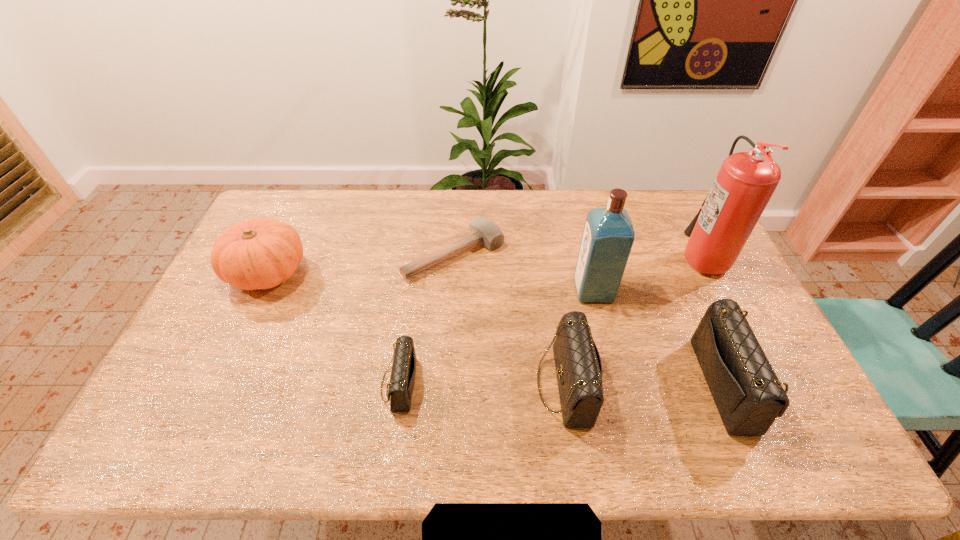
Where is `the sixth tallest object`? The width and height of the screenshot is (960, 540). the sixth tallest object is located at coordinates (402, 378).

Identify the location of the shortest clutch bag. This screenshot has width=960, height=540. (402, 378).

This screenshot has height=540, width=960. I want to click on the fourth object from left to right, so click(x=578, y=365).

Identify the location of the second tallest clutch bag. (578, 365).

Where is `the rightmost clutch bag`? This screenshot has height=540, width=960. the rightmost clutch bag is located at coordinates (749, 397).

Where is `the tallest object`? Image resolution: width=960 pixels, height=540 pixels. the tallest object is located at coordinates (746, 181).

You are a GUI agent. You are given a task and a screenshot of the screen. Output one action in this format:
    pyautogui.click(x=<x>, y=<y>)
    Task: Click on the shortest object
    
    Given the screenshot: What is the action you would take?
    pyautogui.click(x=483, y=231)

Locate an element on the screen. The width and height of the screenshot is (960, 540). the sixth shortest object is located at coordinates (608, 236).

Where is `liquor`? Image resolution: width=960 pixels, height=540 pixels. liquor is located at coordinates click(608, 236).

Locate an element on the screen. The width and height of the screenshot is (960, 540). pumpkin is located at coordinates (262, 253).